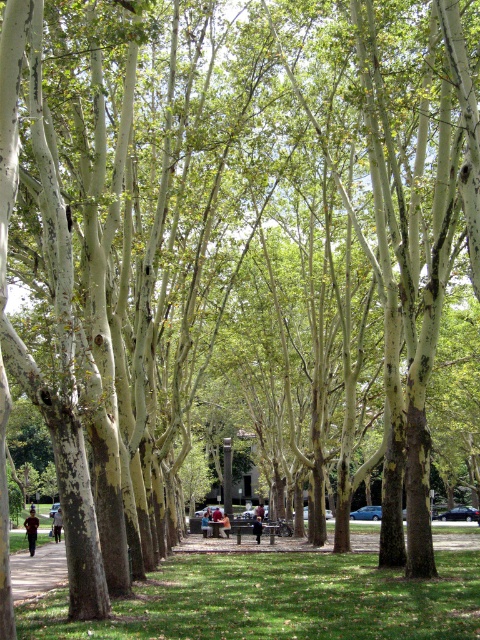
The width and height of the screenshot is (480, 640). What do you see at coordinates (31, 531) in the screenshot?
I see `dark blue uniform at center` at bounding box center [31, 531].

Can you confirm if dark blue uniform at center is smaller than dark blue jeans at center?

Incorrect, dark blue uniform at center is not smaller in size than dark blue jeans at center.

Who is more forward, (35, 540) or (259, 532)?

Point (35, 540) is more forward.

Locate an element on the screen. This screenshot has height=640, width=480. dark blue uniform at center is located at coordinates (31, 531).

Between point (226, 525) and point (254, 524), which one is positioned in front?

Point (254, 524) is more forward.

Between point (222, 524) and point (257, 525), which one is positioned behind?

The point (222, 524) is behind.

Is point (222, 536) positioned in front of point (259, 541)?

That is False.

Identify the location of brown leather jacket at center. (225, 525).

Which is more to the right, light brown leather jacket at center or dark blue jeans at center?

Positioned to the right is dark blue jeans at center.

Is light brown leather jacket at center to the right of dark blue jeans at center from the viewer's perspective?

No, light brown leather jacket at center is not to the right of dark blue jeans at center.

You are a GUI agent. You are given a task and a screenshot of the screen. Output one action in this format:
    pyautogui.click(x=<x>, y=<y>)
    Task: Click on the light brown leather jacket at center
    
    Given the screenshot: What is the action you would take?
    pyautogui.click(x=57, y=524)